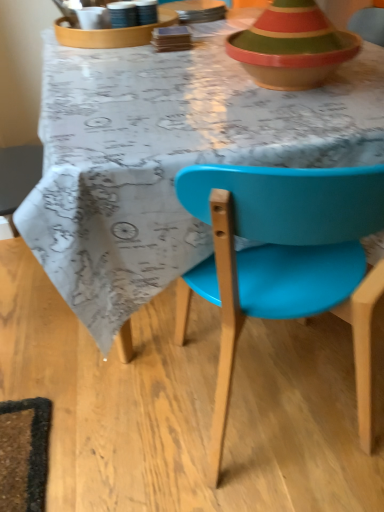
Question: Considering the relative sizes of matte plastic chair at center and matte white tray at upper center, positioned as the second tableware in right-to-left order, in the image provided, is matte plastic chair at center wider than matte white tray at upper center, positioned as the second tableware in right-to-left order,?

Choices:
 (A) yes
 (B) no

Answer: (A)

Question: Is matte plastic chair at center turned away from matte white tray at upper center, the first tableware from the left?

Choices:
 (A) yes
 (B) no

Answer: (B)

Question: Considering the relative positions of matte plastic chair at center and matte white tray at upper center, the first tableware from the left, in the image provided, is matte plastic chair at center in front of matte white tray at upper center, the first tableware from the left,?

Choices:
 (A) no
 (B) yes

Answer: (B)

Question: Is matte plastic chair at center at the left side of matte white tray at upper center, positioned as the second tableware in right-to-left order?

Choices:
 (A) yes
 (B) no

Answer: (B)

Question: From a real-world perspective, is matte plastic chair at center on top of matte white tray at upper center, the first tableware from the left?

Choices:
 (A) yes
 (B) no

Answer: (B)

Question: Considering the positions of matte plastic chair at center and matte plastic chair at center in the image, is matte plastic chair at center taller or shorter than matte plastic chair at center?

Choices:
 (A) tall
 (B) short

Answer: (B)

Question: Based on their positions, is matte plastic chair at center located to the left or right of matte plastic chair at center?

Choices:
 (A) right
 (B) left

Answer: (B)

Question: Relative to matte plastic chair at center, is matte plastic chair at center in front or behind?

Choices:
 (A) behind
 (B) front

Answer: (A)

Question: From a real-world perspective, is matte plastic chair at center positioned above or below matte plastic chair at center?

Choices:
 (A) below
 (B) above

Answer: (A)

Question: Is matte plastic chair at center taller or shorter than matte plastic chair at center?

Choices:
 (A) tall
 (B) short

Answer: (A)

Question: From a real-world perspective, relative to matte plastic chair at center, is matte plastic chair at center vertically above or below?

Choices:
 (A) above
 (B) below

Answer: (A)

Question: Considering the positions of matte plastic chair at center and matte plastic chair at center in the image, is matte plastic chair at center bigger or smaller than matte plastic chair at center?

Choices:
 (A) big
 (B) small

Answer: (B)

Question: Is point (352, 314) positioned closer to the camera than point (147, 174)?

Choices:
 (A) closer
 (B) farther

Answer: (B)

Question: Looking at the image, does matte white tray at upper center, the first tableware from the left, seem bigger or smaller compared to matte plastic chair at center?

Choices:
 (A) small
 (B) big

Answer: (A)

Question: Visually, is matte white tray at upper center, the first tableware from the left, positioned to the left or to the right of matte plastic chair at center?

Choices:
 (A) left
 (B) right

Answer: (A)